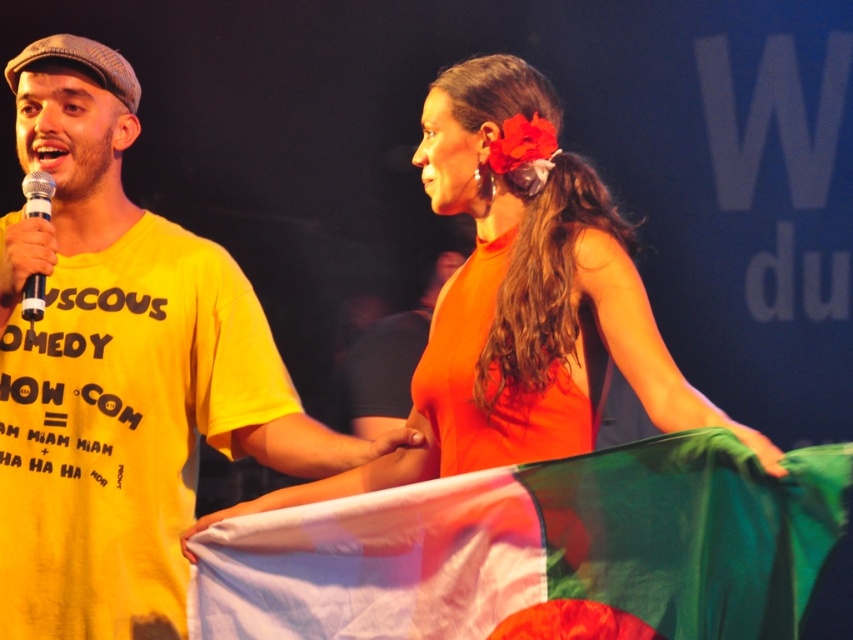
Does yellow cotton t-shirt at left appear on the right side of translucent fabric flag at lower center?

Incorrect, yellow cotton t-shirt at left is not on the right side of translucent fabric flag at lower center.

This screenshot has width=853, height=640. What are the coordinates of `yellow cotton t-shirt at left` in the screenshot? It's located at (125, 376).

Can you confirm if orange fabric at center is positioned to the left of silver metallic microphone at left?

In fact, orange fabric at center is to the right of silver metallic microphone at left.

Is orange fabric at center wider than silver metallic microphone at left?

Correct, the width of orange fabric at center exceeds that of silver metallic microphone at left.

Measure the distance between orange fabric at center and camera.

orange fabric at center is 17.79 feet from camera.

You are a GUI agent. You are given a task and a screenshot of the screen. Output one action in this format:
    pyautogui.click(x=<x>, y=<y>)
    Task: Click on the orange fabric at center
    The image size is (853, 640).
    Given the screenshot: What is the action you would take?
    pyautogui.click(x=390, y=358)

Does translucent fabric flag at lower center appear on the right side of silver metallic microphone at left?

Yes, translucent fabric flag at lower center is to the right of silver metallic microphone at left.

Is translucent fabric flag at lower center bigger than silver metallic microphone at left?

Indeed, translucent fabric flag at lower center has a larger size compared to silver metallic microphone at left.

Who is more distant from viewer, (277,524) or (39,182)?

The point (39,182) is more distant.

The width and height of the screenshot is (853, 640). Find the location of `translucent fabric flag at lower center`. translucent fabric flag at lower center is located at coordinates (538, 550).